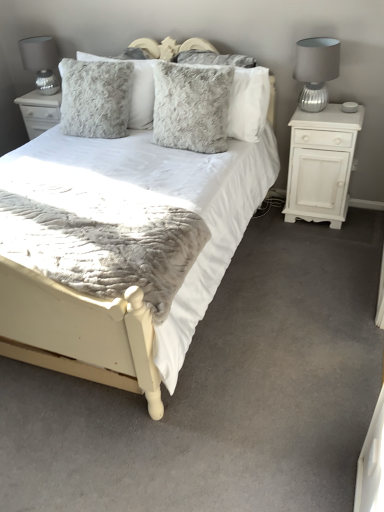
At what (x,y) coordinates should I click in order to perform the action: click on white fabric bed at center. Please return your answer as a coordinate pair (x, y). This screenshot has width=384, height=512. Looking at the image, I should click on click(66, 365).

What do you see at coordinates (321, 164) in the screenshot?
I see `white matte cabinet at right` at bounding box center [321, 164].

This screenshot has height=512, width=384. What do you see at coordinates (142, 95) in the screenshot?
I see `fuzzy gray pillow at upper center, arranged as the third pillow when viewed from the right` at bounding box center [142, 95].

In order to face fuzzy gray pillow at upper center, which is counted as the first pillow, starting from the left, should I rotate leftwards or rightwards?

It's best to rotate left around 11.358 degrees.

Describe the element at coordinates (191, 106) in the screenshot. I see `fuzzy gray pillow at center, placed as the second pillow when sorted from right to left` at that location.

What is the approximate height of fuzzy gray pillow at center, which ranks as the second pillow in left-to-right order?

The height of fuzzy gray pillow at center, which ranks as the second pillow in left-to-right order, is 22.80 inches.

The height and width of the screenshot is (512, 384). In order to click on white fabric bed at center in this screenshot , I will do point(66,365).

Can you tell me how much fuzzy gray pillow at center, the third pillow from the left, and white matte cabinet at right differ in facing direction?

There is a 0.652-degree angle between the facing directions of fuzzy gray pillow at center, the third pillow from the left, and white matte cabinet at right.

Locate an element on the screen. the 1st pillow in front of the white matte cabinet at right, counting from the anchor's position is located at coordinates (240, 92).

From the image's perspective, which one is positioned higher, fuzzy gray pillow at center, the third pillow from the left, or white matte cabinet at right?

fuzzy gray pillow at center, the third pillow from the left.

Based on the photo, between fuzzy gray pillow at center, the third pillow from the left, and white matte cabinet at right, which one has smaller width?

With smaller width is fuzzy gray pillow at center, the third pillow from the left.

From the image's perspective, does white matte cabinet at right appear higher than satin silver lampshade at upper left, which is the second table lamp in front-to-back order?

No.

Is satin silver lampshade at upper left, marked as the first table lamp in a left-to-right arrangement, surrounded by white matte cabinet at right?

That's incorrect, satin silver lampshade at upper left, marked as the first table lamp in a left-to-right arrangement, is not inside white matte cabinet at right.

Which of these two, white matte cabinet at right or satin silver lampshade at upper left, marked as the first table lamp in a left-to-right arrangement, stands shorter?

satin silver lampshade at upper left, marked as the first table lamp in a left-to-right arrangement, is shorter.

Is fuzzy gray pillow at upper center, which is counted as the first pillow, starting from the left, looking in the opposite direction of white fabric bed at center?

Yes, fuzzy gray pillow at upper center, which is counted as the first pillow, starting from the left,'s orientation is away from white fabric bed at center.

How different are the orientations of fuzzy gray pillow at upper center, arranged as the third pillow when viewed from the right, and white fabric bed at center in degrees?

The facing directions of fuzzy gray pillow at upper center, arranged as the third pillow when viewed from the right, and white fabric bed at center are 8.81 degrees apart.

Is fuzzy gray pillow at upper center, which is counted as the first pillow, starting from the left, taller than white fabric bed at center?

Incorrect, the height of fuzzy gray pillow at upper center, which is counted as the first pillow, starting from the left, is not larger of that of white fabric bed at center.

From a real-world perspective, is fuzzy gray pillow at upper center, which is counted as the first pillow, starting from the left, below white fabric bed at center?

No, from a real-world perspective, fuzzy gray pillow at upper center, which is counted as the first pillow, starting from the left, is not beneath white fabric bed at center.

Looking at this image, is fuzzy gray pillow at center, the third pillow from the left, positioned far away from satin silver lampshade at upper left, marked as the first table lamp in a left-to-right arrangement?

fuzzy gray pillow at center, the third pillow from the left, is far away from satin silver lampshade at upper left, marked as the first table lamp in a left-to-right arrangement.

The image size is (384, 512). There is a satin silver lampshade at upper left, the second table lamp positioned from the right. In order to click on the 3rd pillow below it (from a real-world perspective) in this screenshot , I will do `click(240, 92)`.

Considering the relative sizes of fuzzy gray pillow at center, the first pillow in the right-to-left sequence, and satin silver lampshade at upper left, marked as the first table lamp in a left-to-right arrangement, in the image provided, is fuzzy gray pillow at center, the first pillow in the right-to-left sequence, thinner than satin silver lampshade at upper left, marked as the first table lamp in a left-to-right arrangement,?

→ Indeed, fuzzy gray pillow at center, the first pillow in the right-to-left sequence, has a lesser width compared to satin silver lampshade at upper left, marked as the first table lamp in a left-to-right arrangement.

Based on the photo, considering the positions of objects fuzzy gray pillow at center, the third pillow from the left, and fuzzy gray pillow at upper center, which is counted as the first pillow, starting from the left, in the image provided, who is in front, fuzzy gray pillow at center, the third pillow from the left, or fuzzy gray pillow at upper center, which is counted as the first pillow, starting from the left,?

fuzzy gray pillow at center, the third pillow from the left, is in front.

Is fuzzy gray pillow at center, the third pillow from the left, aimed at fuzzy gray pillow at upper center, arranged as the third pillow when viewed from the right?

No, fuzzy gray pillow at center, the third pillow from the left, is not aimed at fuzzy gray pillow at upper center, arranged as the third pillow when viewed from the right.

This screenshot has height=512, width=384. In the image, there is a fuzzy gray pillow at center, the third pillow from the left. Find the location of `pillow above it (from the image's perspective)`. pillow above it (from the image's perspective) is located at coordinates click(x=142, y=95).

In terms of size, does fuzzy gray pillow at center, the third pillow from the left, appear bigger or smaller than fuzzy gray pillow at upper center, which is counted as the first pillow, starting from the left?

fuzzy gray pillow at center, the third pillow from the left, is smaller than fuzzy gray pillow at upper center, which is counted as the first pillow, starting from the left.

Considering the relative sizes of satin silver lampshade at upper left, marked as the first table lamp in a left-to-right arrangement, and fuzzy gray pillow at center, the third pillow from the left, in the image provided, is satin silver lampshade at upper left, marked as the first table lamp in a left-to-right arrangement, wider than fuzzy gray pillow at center, the third pillow from the left,?

Indeed, satin silver lampshade at upper left, marked as the first table lamp in a left-to-right arrangement, has a greater width compared to fuzzy gray pillow at center, the third pillow from the left.

From the image's perspective, relative to fuzzy gray pillow at center, the third pillow from the left, is satin silver lampshade at upper left, positioned as the first table lamp in back-to-front order, above or below?

Based on their image positions, satin silver lampshade at upper left, positioned as the first table lamp in back-to-front order, is located above fuzzy gray pillow at center, the third pillow from the left.

Is satin silver lampshade at upper left, positioned as the first table lamp in back-to-front order, positioned behind fuzzy gray pillow at center, the third pillow from the left?

Yes, it is.

Is there a large distance between satin silver lampshade at upper left, the second table lamp positioned from the right, and fuzzy gray pillow at center, the third pillow from the left?

Yes, satin silver lampshade at upper left, the second table lamp positioned from the right, and fuzzy gray pillow at center, the third pillow from the left, are located far from each other.

Is fuzzy gray pillow at upper center, arranged as the third pillow when viewed from the right, thinner than fuzzy gray pillow at center, the first pillow in the right-to-left sequence?

No.

Is fuzzy gray pillow at upper center, arranged as the third pillow when viewed from the right, aimed at fuzzy gray pillow at center, the first pillow in the right-to-left sequence?

No, fuzzy gray pillow at upper center, arranged as the third pillow when viewed from the right, is not oriented towards fuzzy gray pillow at center, the first pillow in the right-to-left sequence.

Is fuzzy gray pillow at upper center, arranged as the third pillow when viewed from the right, positioned behind fuzzy gray pillow at center, the first pillow in the right-to-left sequence?

Yes, the depth of fuzzy gray pillow at upper center, arranged as the third pillow when viewed from the right, is greater than that of fuzzy gray pillow at center, the first pillow in the right-to-left sequence.

Considering the points (147, 124) and (186, 61), which point is behind, point (147, 124) or point (186, 61)?

The point (147, 124) is behind.

The width and height of the screenshot is (384, 512). In order to click on nightstand below the fuzzy gray pillow at center, the first pillow in the right-to-left sequence (from the image's perspective) in this screenshot , I will do `click(321, 164)`.

Identify the location of the 2nd table lamp above when counting from the white matte cabinet at right (from the image's perspective). The image size is (384, 512). (41, 62).

Looking at the image, which one is located closer to fuzzy gray pillow at upper center, arranged as the third pillow when viewed from the right, satin silver lampshade at upper left, which is the second table lamp in front-to-back order, or fuzzy gray pillow at center, the first pillow in the right-to-left sequence?

fuzzy gray pillow at center, the first pillow in the right-to-left sequence, is positioned closer to the anchor fuzzy gray pillow at upper center, arranged as the third pillow when viewed from the right.

Considering their positions, is satin silver lampshade at upper left, the second table lamp positioned from the right, positioned closer to fuzzy gray pillow at upper center, arranged as the third pillow when viewed from the right, than fuzzy gray pillow at center, which ranks as the second pillow in left-to-right order?

fuzzy gray pillow at center, which ranks as the second pillow in left-to-right order.

Based on their spatial positions, is fuzzy gray pillow at upper center, arranged as the third pillow when viewed from the right, or white matte cabinet at right closer to silver ribbed glass table lamp at right, the 1th table lamp positioned from the front?

white matte cabinet at right lies closer to silver ribbed glass table lamp at right, the 1th table lamp positioned from the front, than the other object.

From the picture: Which object lies nearer to the anchor point white matte cabinet at right, fuzzy gray pillow at center, the first pillow in the right-to-left sequence, or fuzzy gray pillow at upper center, arranged as the third pillow when viewed from the right?

fuzzy gray pillow at center, the first pillow in the right-to-left sequence, is closer to white matte cabinet at right.

Based on their spatial positions, is white matte cabinet at right or satin silver lampshade at upper left, which is the second table lamp in front-to-back order, closer to fuzzy gray pillow at upper center, arranged as the third pillow when viewed from the right?

Based on the image, satin silver lampshade at upper left, which is the second table lamp in front-to-back order, appears to be nearer to fuzzy gray pillow at upper center, arranged as the third pillow when viewed from the right.

Estimate the real-world distances between objects in this image. Which object is closer to silver ribbed glass table lamp at right, the 1th table lamp positioned from the front, white matte cabinet at right or white fabric bed at center?

white matte cabinet at right.

Estimate the real-world distances between objects in this image. Which object is closer to white fabric bed at center, silver ribbed glass table lamp at right, which appears as the second table lamp when viewed from the back, or fuzzy gray pillow at center, the third pillow from the left?

Among the two, fuzzy gray pillow at center, the third pillow from the left, is located nearer to white fabric bed at center.

When comparing their distances from silver ribbed glass table lamp at right, the 1th table lamp positioned from the front, does fuzzy gray pillow at center, the first pillow in the right-to-left sequence, or white matte cabinet at right seem closer?

white matte cabinet at right.

Locate an element on the screen. table lamp between satin silver lampshade at upper left, which is the second table lamp in front-to-back order, and white matte cabinet at right, in the horizontal direction is located at coordinates (316, 70).

You are a GUI agent. You are given a task and a screenshot of the screen. Output one action in this format:
    pyautogui.click(x=<x>, y=<y>)
    Task: Click on the table lamp situated between fuzzy gray pillow at center, which ranks as the second pillow in left-to-right order, and white matte cabinet at right from left to right
    
    Given the screenshot: What is the action you would take?
    pyautogui.click(x=316, y=70)

In order to click on bed between satin silver lampshade at upper left, positioned as the first table lamp in back-to-front order, and white matte cabinet at right, in the horizontal direction in this screenshot , I will do `click(66, 365)`.

You are a GUI agent. You are given a task and a screenshot of the screen. Output one action in this format:
    pyautogui.click(x=<x>, y=<y>)
    Task: Click on the pillow between fuzzy gray pillow at center, which ranks as the second pillow in left-to-right order, and silver ribbed glass table lamp at right, the 1th table lamp positioned from the front
    Image resolution: width=384 pixels, height=512 pixels.
    Given the screenshot: What is the action you would take?
    pyautogui.click(x=240, y=92)